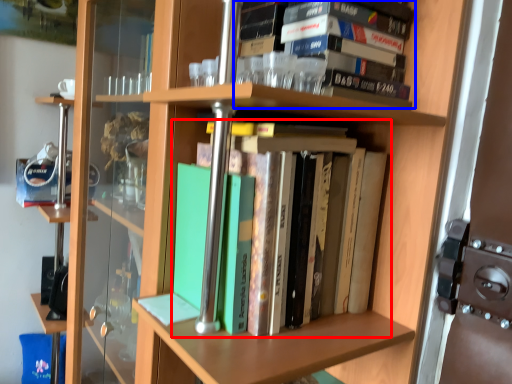
Question: Which of the following is the farthest to the observer, book (highlighted by a red box) or book (highlighted by a blue box)?

Choices:
 (A) book
 (B) book

Answer: (B)